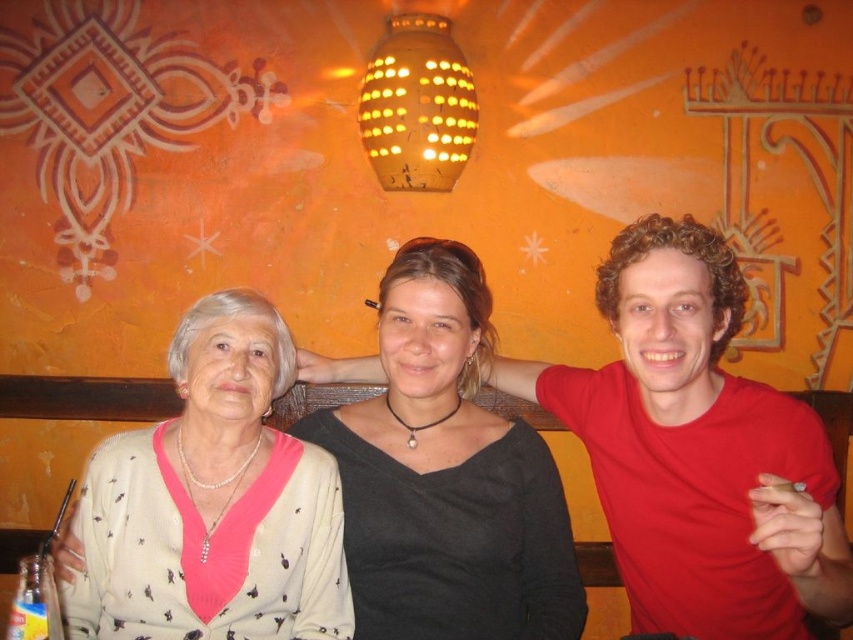
Is point (677, 595) positioned in front of point (192, 577)?

No, it is not.

Is red matte shirt at center taller than pearl necklace at center?

Yes, red matte shirt at center is taller than pearl necklace at center.

Which is behind, point (676, 333) or point (263, 595)?

The point (263, 595) is behind.

Where is `red matte shirt at center`? red matte shirt at center is located at coordinates (697, 451).

The width and height of the screenshot is (853, 640). What do you see at coordinates (445, 476) in the screenshot?
I see `black matte shirt at center` at bounding box center [445, 476].

Does point (396, 376) come closer to viewer compared to point (263, 392)?

No, it is behind (263, 392).

Find the location of a particular element. black matte shirt at center is located at coordinates (445, 476).

Does red matte shirt at center have a greater height compared to black matte shirt at center?

Correct, red matte shirt at center is much taller as black matte shirt at center.

Between red matte shirt at center and black matte shirt at center, which one is positioned higher?

red matte shirt at center is above.

Is point (723, 508) farther from camera compared to point (434, 276)?

No.

You are a GUI agent. You are given a task and a screenshot of the screen. Output one action in this format:
    pyautogui.click(x=<x>, y=<y>)
    Task: Click on the red matte shirt at center
    
    Given the screenshot: What is the action you would take?
    pyautogui.click(x=697, y=451)